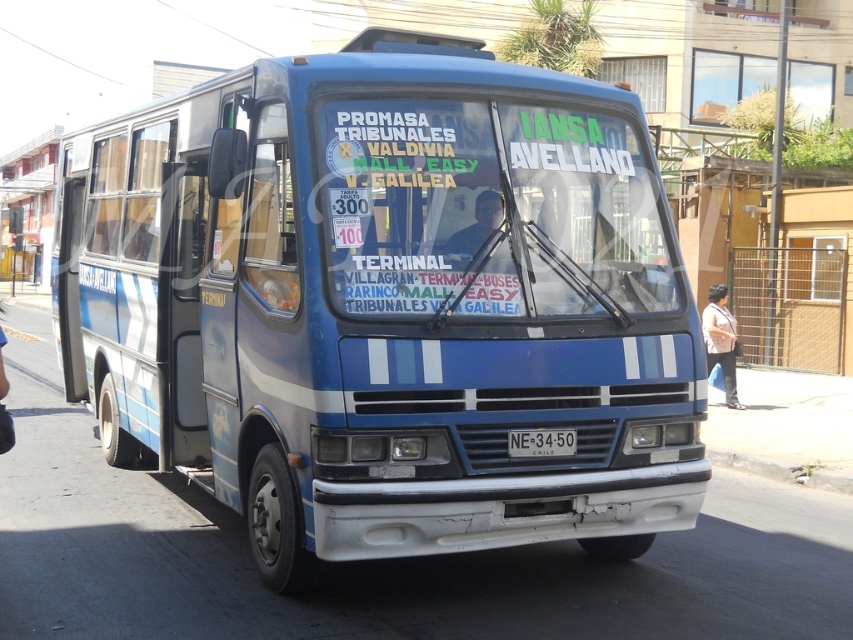
Between blue matte bus at center and white plastic license plate at center, which one appears on the right side from the viewer's perspective?

white plastic license plate at center

Which is in front, point (173, 280) or point (538, 449)?

Point (538, 449) is in front.

Identify the location of blue matte bus at center. (387, 304).